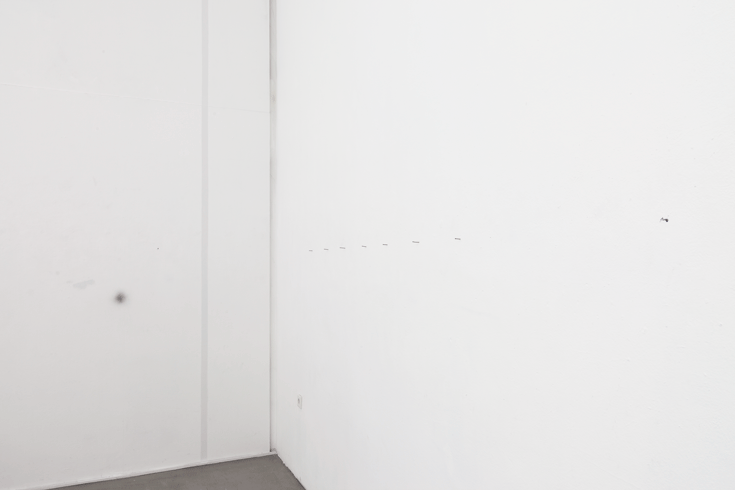
Find the location of `floor`. floor is located at coordinates (257, 484).